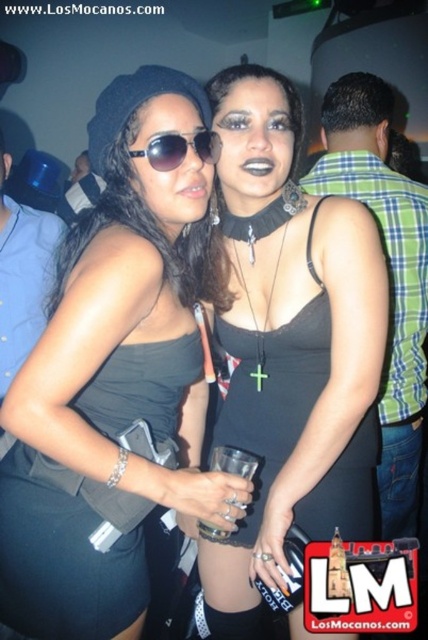
You are a photographer adjusting your camera settings to focus on two specific points in the image. The first point is at coordinates point (6,586) and the second is at point (157,141). Which point should you focus on first if you want to capture the closest object to the camera?

You should focus on point (6,586) first because it is closer to the camera than point (157,141).

You are a photographer adjusting the camera focus. The black matte dress at center is your main subject. Where should you aim the focus point to ensure the dress is sharp?

You should aim the focus point at coordinates point [290,346] to ensure the black matte dress at center is sharp.